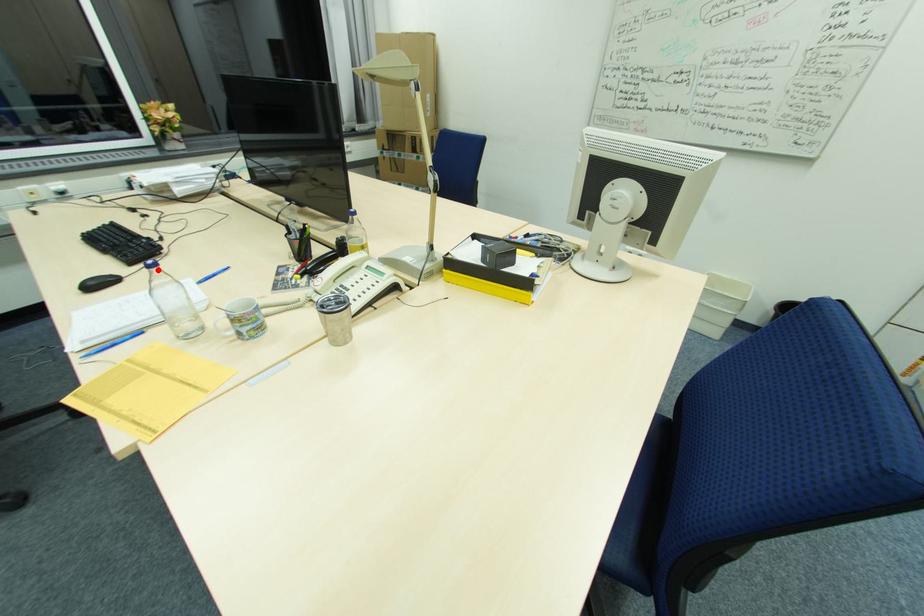
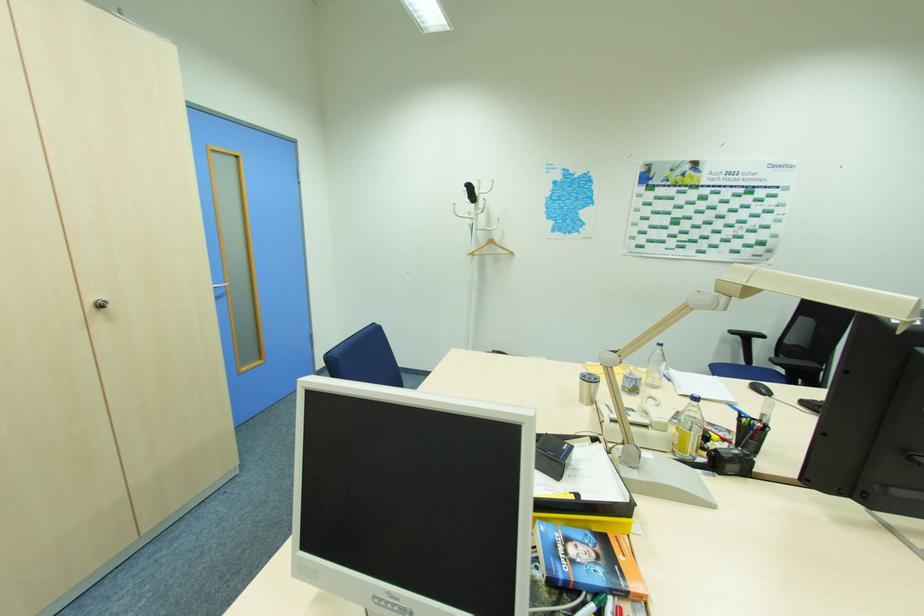
In the second image, find the point that corresponds to the highlighted location in the first image.

(663, 347)